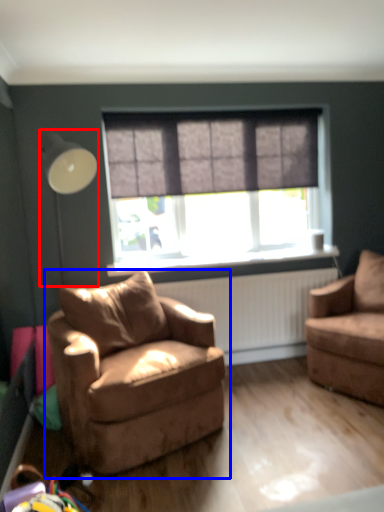
Question: Which of the following is the closest to the observer, table lamp (highlighted by a red box) or chair (highlighted by a blue box)?

Choices:
 (A) table lamp
 (B) chair

Answer: (B)